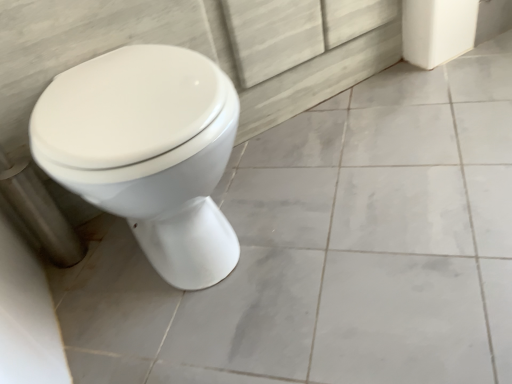
Where is `empty space that is to the right of white glossy toilet at left`? Image resolution: width=512 pixels, height=384 pixels. empty space that is to the right of white glossy toilet at left is located at coordinates (353, 202).